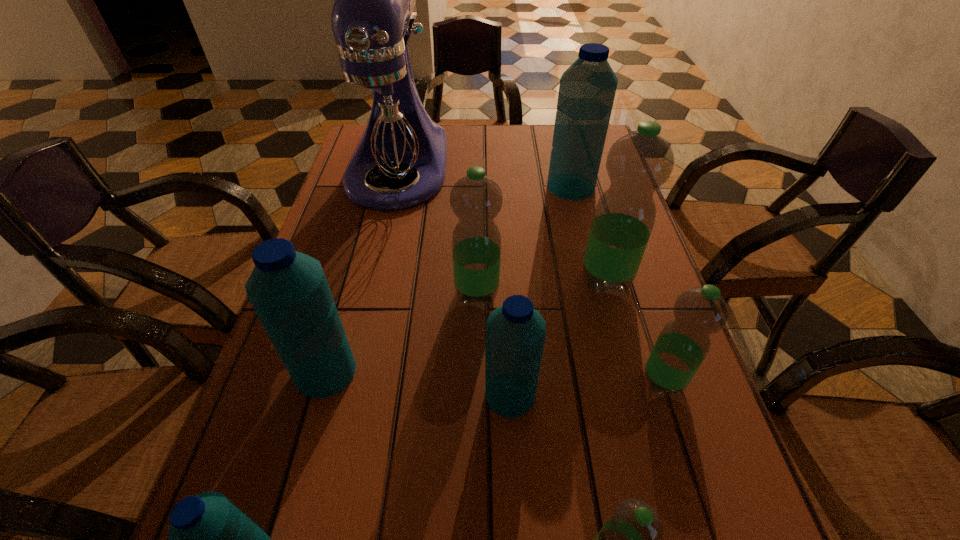
Locate an element on the screen. vacant space at the far edge is located at coordinates (459, 130).

Where is `vacant area at the left edge of the desktop`? The width and height of the screenshot is (960, 540). vacant area at the left edge of the desktop is located at coordinates (337, 237).

Locate an element on the screen. vacant region at the right edge of the desktop is located at coordinates (739, 484).

I want to click on vacant space in between the leftmost green water bottle and the third smallest blue water bottle, so click(401, 332).

Where is `vacant space in between the rightmost blue water bottle and the second smallest blue water bottle`? This screenshot has height=540, width=960. vacant space in between the rightmost blue water bottle and the second smallest blue water bottle is located at coordinates (540, 291).

This screenshot has width=960, height=540. In order to click on vacant area that lies between the leftmost green water bottle and the biggest green water bottle in this screenshot , I will do `click(541, 286)`.

At what (x,y) coordinates should I click in order to perform the action: click on vacant area that lies between the second smallest green water bottle and the mixer. Please return your answer as a coordinate pair (x, y). Looking at the image, I should click on (531, 274).

Locate an element on the screen. the fourth closest object relative to the tallest object is located at coordinates (288, 290).

Identify the location of object that is the second closest to the smallest blue water bottle. The image size is (960, 540). (515, 335).

This screenshot has width=960, height=540. Find the location of `the sixth closest water bottle to the leftmost green water bottle`. the sixth closest water bottle to the leftmost green water bottle is located at coordinates (631, 539).